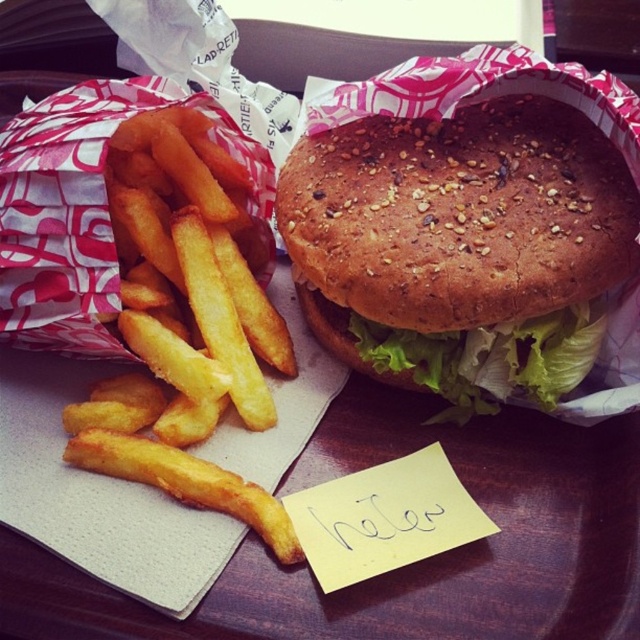
Between sesame seed bun at center and green leafy lettuce at center, which one has less height?

Answer: green leafy lettuce at center is shorter.

Which of these two, sesame seed bun at center or green leafy lettuce at center, stands taller?

Standing taller between the two is sesame seed bun at center.

Describe the element at coordinates (456, 220) in the screenshot. The width and height of the screenshot is (640, 640). I see `sesame seed bun at center` at that location.

At what (x,y) coordinates should I click in order to perform the action: click on sesame seed bun at center. Please return your answer as a coordinate pair (x, y). The height and width of the screenshot is (640, 640). Looking at the image, I should click on (456, 220).

Between sesame seed bun at center and golden crispy french fries at left, which one has less height?

Standing shorter between the two is sesame seed bun at center.

Image resolution: width=640 pixels, height=640 pixels. Find the location of `sesame seed bun at center`. sesame seed bun at center is located at coordinates (456, 220).

Between golden crispy french fries at left and green leafy lettuce at center, which one has more height?

With more height is golden crispy french fries at left.

In the scene shown: Does golden crispy french fries at left appear on the right side of green leafy lettuce at center?

No, golden crispy french fries at left is not to the right of green leafy lettuce at center.

The height and width of the screenshot is (640, 640). I want to click on golden crispy french fries at left, so click(x=186, y=323).